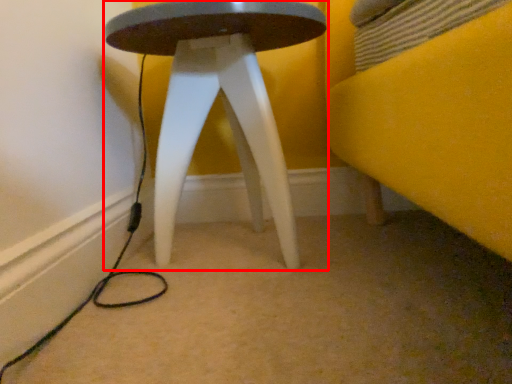
Question: From the image, what is the correct spatial relationship of stool (annotated by the red box) in relation to cable?

Choices:
 (A) left
 (B) right

Answer: (B)